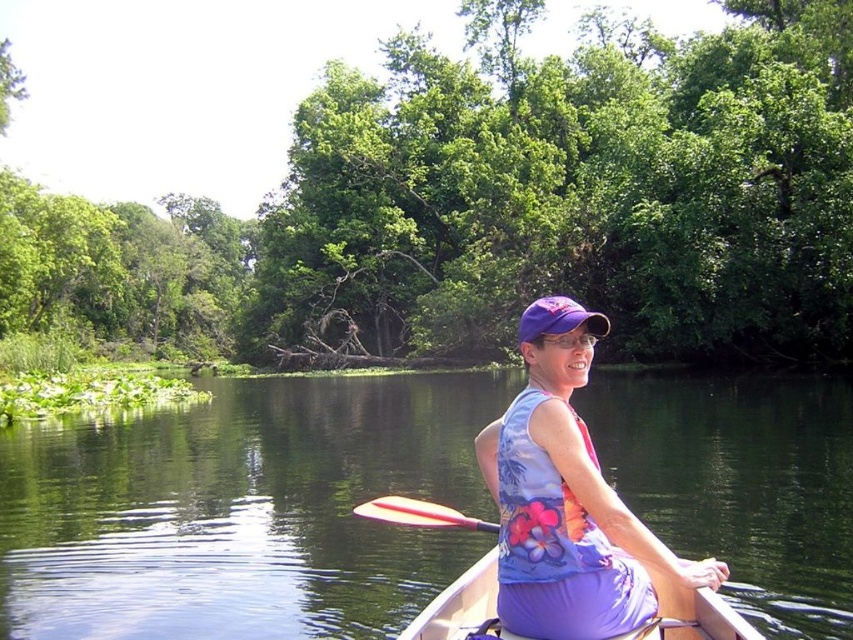
You are a photographer trying to capture a clear shot of the purple fabric tank top at center and the green smooth water at center. Which object is positioned lower in the image?

The green smooth water at center is positioned below the purple fabric tank top at center, so it is lower in the image.